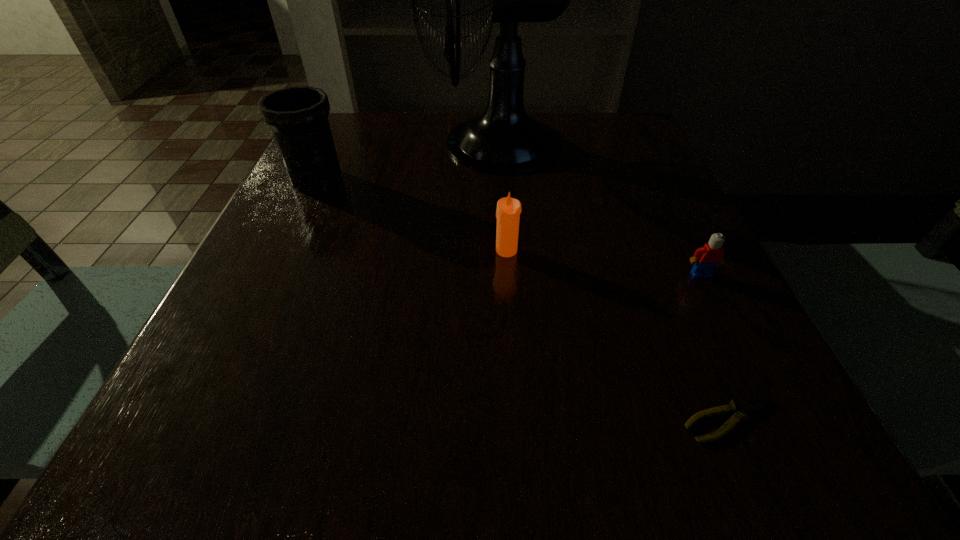
In order to click on pliers located at the right edge in this screenshot , I will do `click(745, 406)`.

The height and width of the screenshot is (540, 960). I want to click on object located in the near right corner section of the desktop, so click(745, 406).

Where is `vacant space at the far edge`? Image resolution: width=960 pixels, height=540 pixels. vacant space at the far edge is located at coordinates (430, 136).

Identify the location of blank space at the near edge of the desktop. (458, 463).

Where is `blank space at the left edge`? The width and height of the screenshot is (960, 540). blank space at the left edge is located at coordinates (246, 271).

The width and height of the screenshot is (960, 540). Find the location of `vacant position at the right edge of the desktop`. vacant position at the right edge of the desktop is located at coordinates (643, 326).

In the image, there is a desktop. Where is `vacant space at the far left corner`? vacant space at the far left corner is located at coordinates (356, 140).

I want to click on free region at the near left corner, so click(x=135, y=476).

Where is `free space between the tallest object and the Lego`? free space between the tallest object and the Lego is located at coordinates (597, 208).

Identify the location of vacant space that is in between the pliers and the telephoto lens. The height and width of the screenshot is (540, 960). (522, 300).